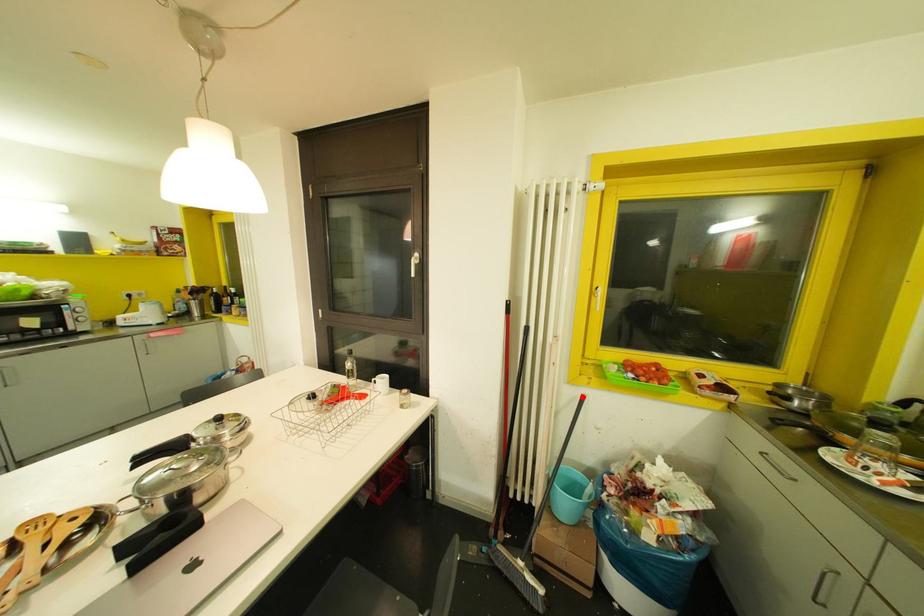
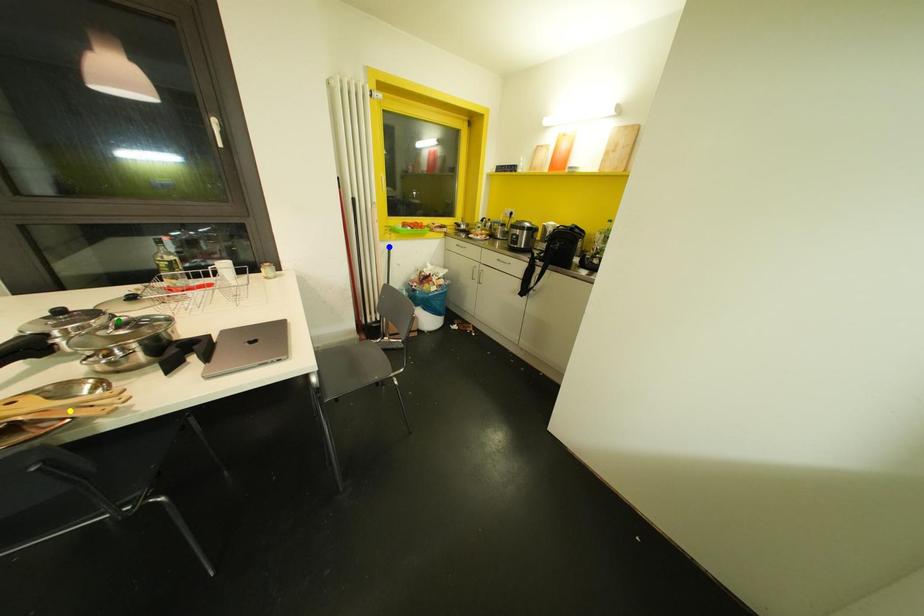
Question: I am providing you with two images of the same scene from different viewpoints. A red point is marked on the first image. You are given multiple points on the second image. Which point in image 2 represents the same 3d spot as the red point in image 1?

Choices:
 (A) yellow point
 (B) green point
 (C) blue point

Answer: (C)